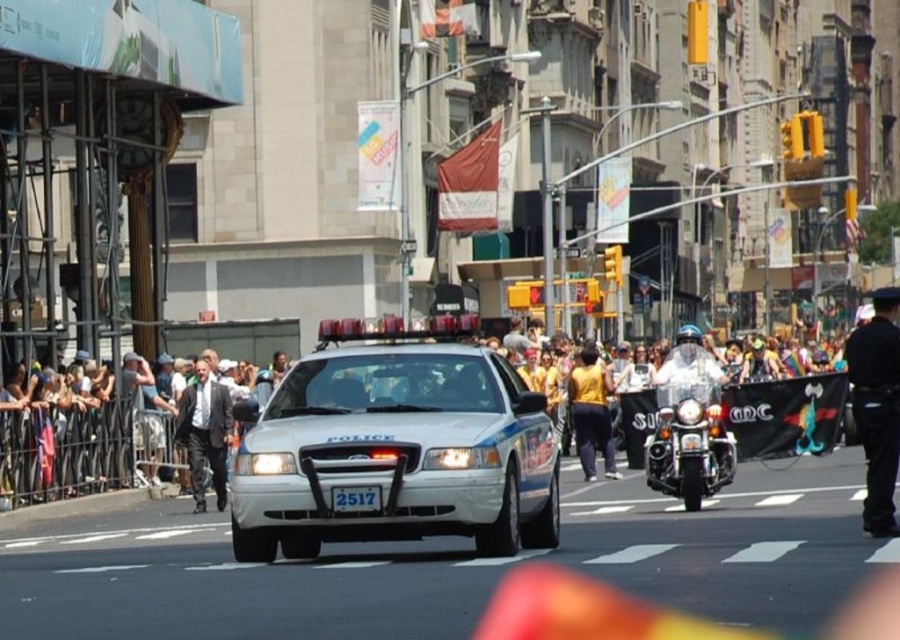
You are standing on the street and see two points marked in the image. Which point is closer to you, point (414, 508) or point (684, 497)?

Point (414, 508) is closer to the viewer than point (684, 497).